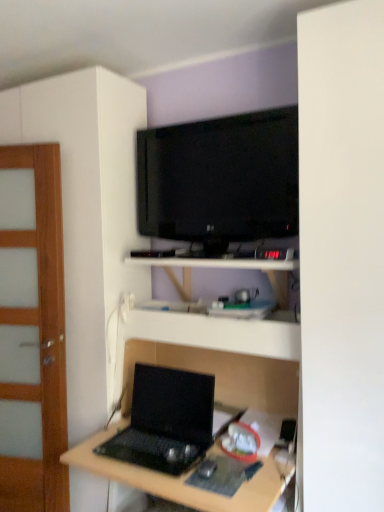
Question: Is black matte laptop at lower center with matte black laptop at center?

Choices:
 (A) no
 (B) yes

Answer: (A)

Question: Is black matte laptop at lower center thinner than matte black laptop at center?

Choices:
 (A) yes
 (B) no

Answer: (A)

Question: Is black matte laptop at lower center completely or partially outside of matte black laptop at center?

Choices:
 (A) no
 (B) yes

Answer: (A)

Question: Does black matte laptop at lower center turn towards matte black laptop at center?

Choices:
 (A) yes
 (B) no

Answer: (A)

Question: Does black matte laptop at lower center have a lesser height compared to matte black laptop at center?

Choices:
 (A) yes
 (B) no

Answer: (A)

Question: From the image's perspective, would you say black matte laptop at lower center is shown under matte black laptop at center?

Choices:
 (A) yes
 (B) no

Answer: (B)

Question: Does black plastic mouse at lower center appear on the left side of white matte shelf at center?

Choices:
 (A) yes
 (B) no

Answer: (A)

Question: Is white matte shelf at center a part of black plastic mouse at lower center?

Choices:
 (A) yes
 (B) no

Answer: (B)

Question: Is black plastic mouse at lower center wider than white matte shelf at center?

Choices:
 (A) yes
 (B) no

Answer: (B)

Question: Can you confirm if black plastic mouse at lower center is taller than white matte shelf at center?

Choices:
 (A) no
 (B) yes

Answer: (A)

Question: Is black plastic mouse at lower center smaller than white matte shelf at center?

Choices:
 (A) no
 (B) yes

Answer: (B)

Question: Is black plastic mouse at lower center oriented away from white matte shelf at center?

Choices:
 (A) yes
 (B) no

Answer: (B)

Question: From the image's perspective, is matte black laptop at center below wooden door at left?

Choices:
 (A) no
 (B) yes

Answer: (B)